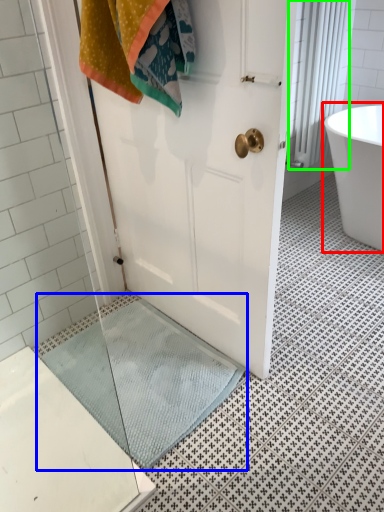
Question: Which is nearer to the bathtub (highlighted by a red box)? bath mat (highlighted by a blue box) or shower curtain (highlighted by a green box).

Choices:
 (A) bath mat
 (B) shower curtain

Answer: (B)